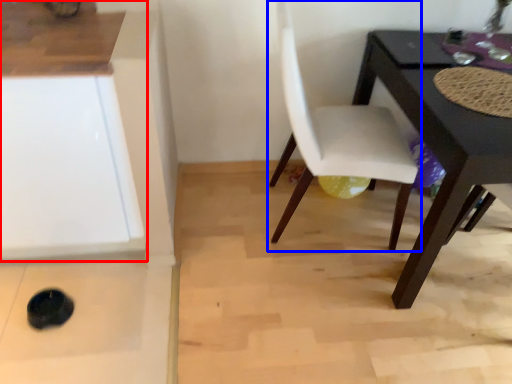
Question: Which object is further to the camera taking this photo, cabinetry (highlighted by a red box) or chair (highlighted by a blue box)?

Choices:
 (A) cabinetry
 (B) chair

Answer: (B)